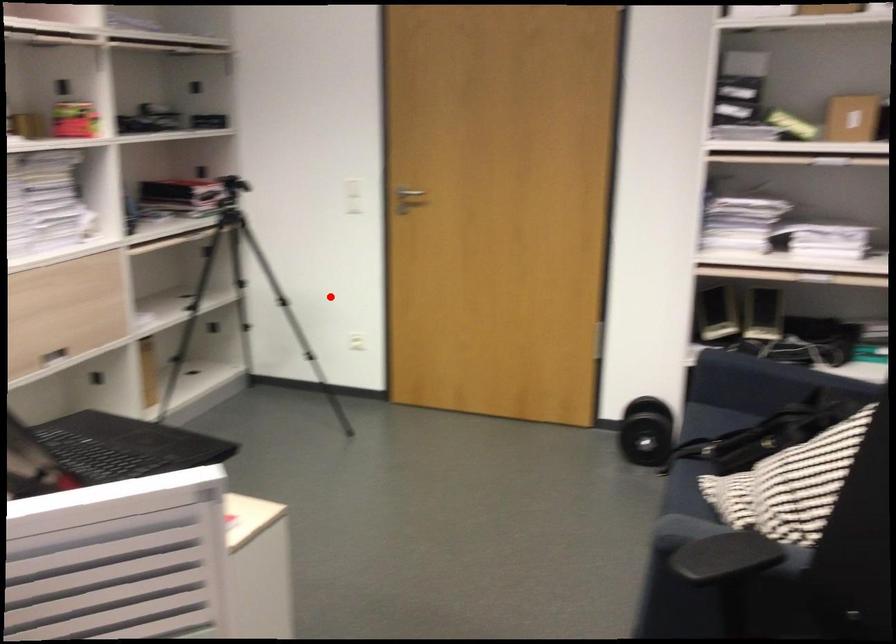
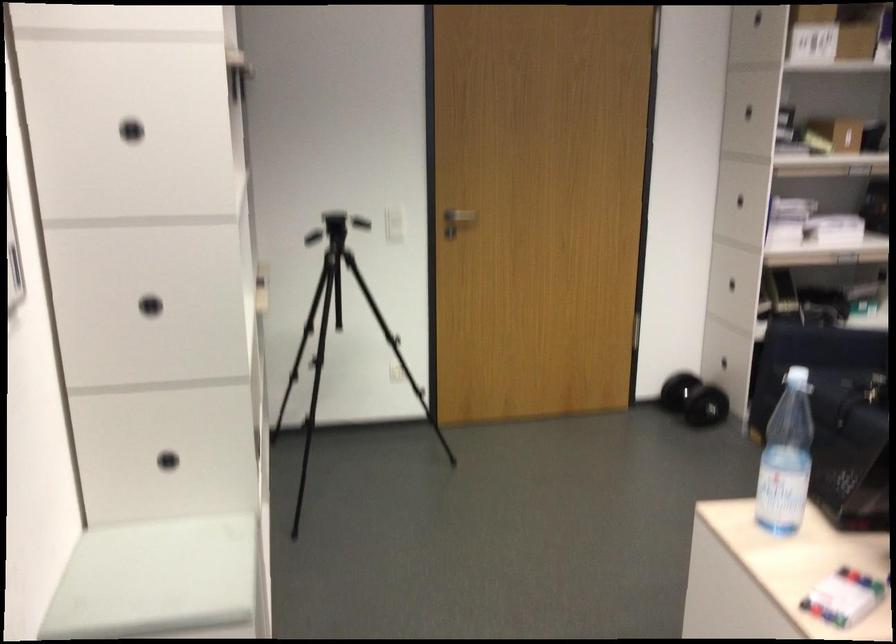
In the second image, find the point that corresponds to the highlighted location in the first image.

(339, 334)